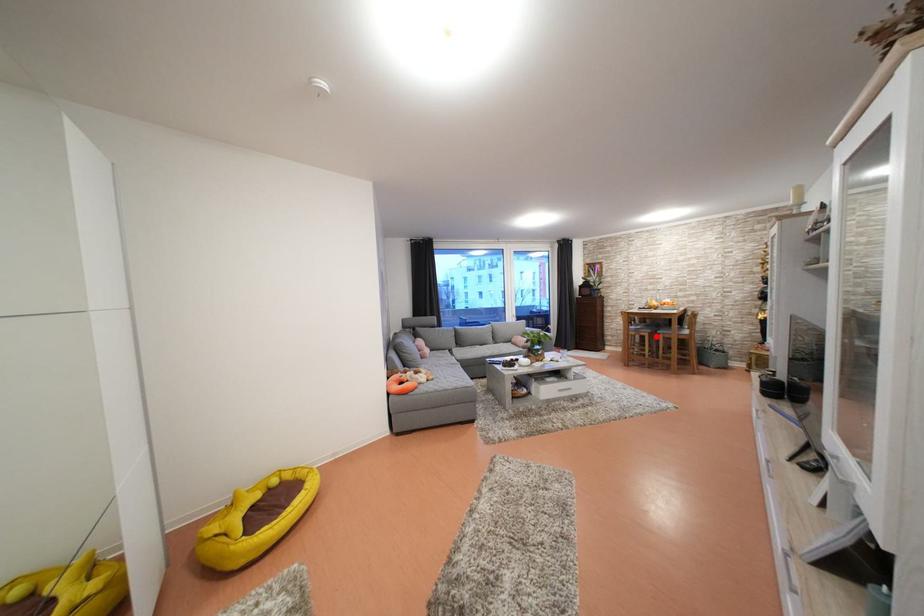
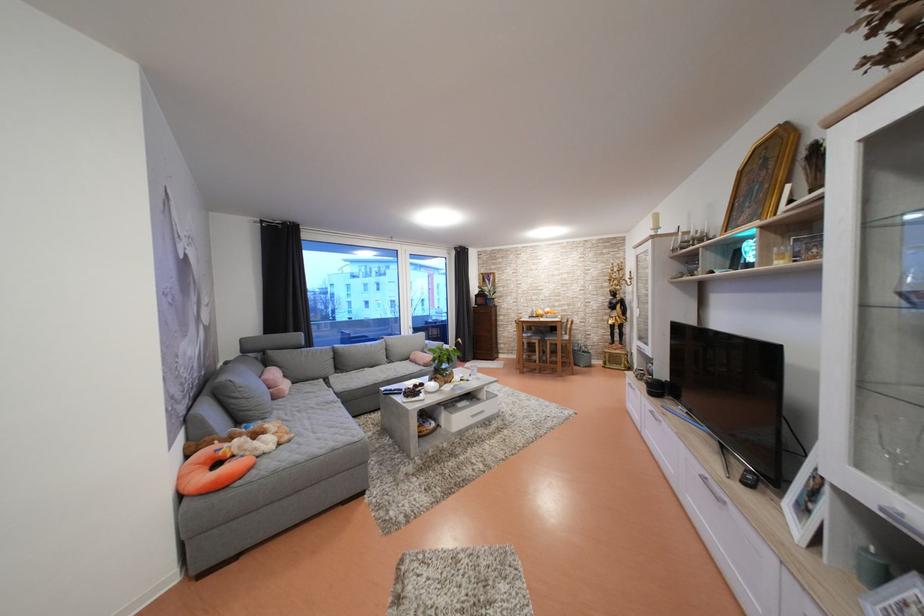
In the second image, find the point that corresponds to the highlighted location in the first image.

(545, 342)